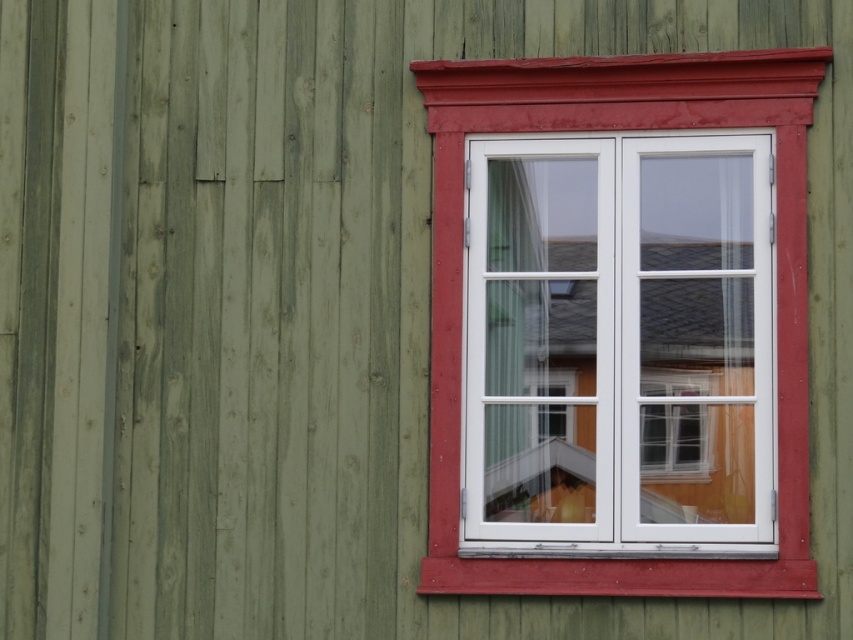
You are standing outside the wooden building and want to see through the window. Can you see the white sheer curtain at center through the matte white window frame at center?

The matte white window frame at center is in front of the white sheer curtain at center, so yes, you can see the white sheer curtain at center through the matte white window frame at center because the frame is in front and allows visibility.

You are standing outside the building and want to know if the matte white window frame at center is taller than the white sheer curtain at center. Can you confirm this based on the scene?

The matte white window frame at center has a greater height compared to the white sheer curtain at center, so yes, the matte white window frame at center is taller than the white sheer curtain at center.

You are an interior designer assessing the window in the wooden building. You need to determine if the white sheer curtain at center can be fully displayed without overlapping the matte white window frame at center. Based on their sizes, what is your conclusion?

The matte white window frame at center is wider than the white sheer curtain at center. Therefore, the white sheer curtain at center can be fully displayed without overlapping the matte white window frame at center since it is narrower.